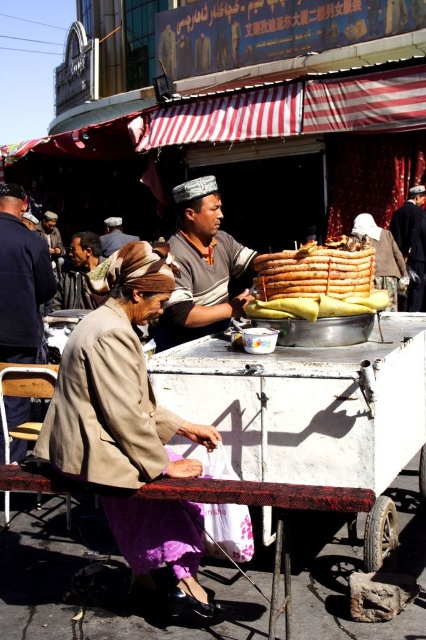
Question: Which of these objects is positioned closest to the brown leather hat at upper left?

Choices:
 (A) white matte cart at center
 (B) brown cotton shirt at center
 (C) brown leather hat at center
 (D) brown leather jacket at lower left

Answer: (C)

Question: Is beige fabric jacket at center wider than dark blue fabric jacket at right?

Choices:
 (A) no
 (B) yes

Answer: (B)

Question: Which object is positioned closest to the white matte cart at center?

Choices:
 (A) golden brown bread at center
 (B) brown leather jacket at lower left

Answer: (A)

Question: Which object appears farthest from the camera in this image?

Choices:
 (A) white matte cart at center
 (B) brown leather jacket at lower left

Answer: (B)

Question: Can you confirm if golden brown bread at center is smaller than dark blue fabric jacket at right?

Choices:
 (A) yes
 (B) no

Answer: (B)

Question: Can you confirm if brown leather jacket at lower left is smaller than dark blue fabric jacket at right?

Choices:
 (A) yes
 (B) no

Answer: (B)